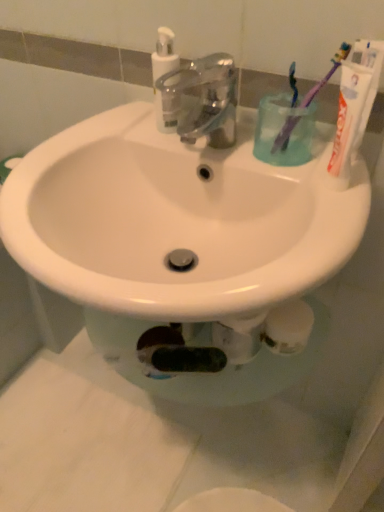
Identify the location of white glossy sink at center. The height and width of the screenshot is (512, 384). (180, 242).

Where is `metallic faucet at center`? The height and width of the screenshot is (512, 384). metallic faucet at center is located at coordinates (201, 100).

Describe the element at coordinates (326, 75) in the screenshot. This screenshot has height=512, width=384. I see `purple plastic toothbrush at upper right, acting as the 2th toothbrush starting from the left` at that location.

What do you see at coordinates (280, 130) in the screenshot?
I see `translucent plastic cup at upper right` at bounding box center [280, 130].

Where is `translucent plastic pump bottle at upper center`? translucent plastic pump bottle at upper center is located at coordinates (164, 73).

In the scene shown: Could you tell me if white matte toothpaste at upper right is turned towards purple plastic toothbrush at upper right, which is the first toothbrush from left to right?

No, white matte toothpaste at upper right is not aimed at purple plastic toothbrush at upper right, which is the first toothbrush from left to right.

Is white matte toothpaste at upper right in front of or behind purple plastic toothbrush at upper right, which is the first toothbrush from left to right, in the image?

In the image, white matte toothpaste at upper right appears in front of purple plastic toothbrush at upper right, which is the first toothbrush from left to right.

Based on their positions, is white matte toothpaste at upper right located to the left or right of purple plastic toothbrush at upper right, which is the first toothbrush from left to right?

Clearly, white matte toothpaste at upper right is on the right of purple plastic toothbrush at upper right, which is the first toothbrush from left to right, in the image.

Does point (335, 133) come behind point (295, 63)?

Yes, point (335, 133) is farther from viewer.

Does white matte toothpaste at upper right lie behind purple plastic toothbrush at upper right, acting as the 2th toothbrush starting from the left?

No, white matte toothpaste at upper right is in front of purple plastic toothbrush at upper right, acting as the 2th toothbrush starting from the left.

Is white matte toothpaste at upper right at the left side of purple plastic toothbrush at upper right, acting as the 2th toothbrush starting from the left?

Incorrect, white matte toothpaste at upper right is not on the left side of purple plastic toothbrush at upper right, acting as the 2th toothbrush starting from the left.

How different are the orientations of white matte toothpaste at upper right and purple plastic toothbrush at upper right, acting as the 2th toothbrush starting from the left, in degrees?

The angle between the facing direction of white matte toothpaste at upper right and the facing direction of purple plastic toothbrush at upper right, acting as the 2th toothbrush starting from the left, is 8.32e-06 degrees.

Is point (361, 66) positioned in front of point (331, 69)?

Yes.

Which is nearer, (159, 97) or (300, 118)?

Point (300, 118)

Considering the relative sizes of translucent plastic pump bottle at upper center and purple plastic toothbrush at upper right, acting as the 2th toothbrush starting from the left, in the image provided, is translucent plastic pump bottle at upper center wider than purple plastic toothbrush at upper right, acting as the 2th toothbrush starting from the left,?

No.

Considering the sizes of objects translucent plastic pump bottle at upper center and purple plastic toothbrush at upper right, which is the first toothbrush from right to left, in the image provided, who is shorter, translucent plastic pump bottle at upper center or purple plastic toothbrush at upper right, which is the first toothbrush from right to left,?

Standing shorter between the two is translucent plastic pump bottle at upper center.

Is translucent plastic pump bottle at upper center directly adjacent to purple plastic toothbrush at upper right, acting as the 2th toothbrush starting from the left?

translucent plastic pump bottle at upper center and purple plastic toothbrush at upper right, acting as the 2th toothbrush starting from the left, are not in contact.

Is white matte toothpaste at upper right next to white glossy sink at center and touching it?

No, white matte toothpaste at upper right is not next to white glossy sink at center.

Between white matte toothpaste at upper right and white glossy sink at center, which one has smaller width?

Thinner between the two is white matte toothpaste at upper right.

Based on the photo, who is smaller, white matte toothpaste at upper right or white glossy sink at center?

white matte toothpaste at upper right is smaller.

Is purple plastic toothbrush at upper right, which is the first toothbrush from right to left, spatially inside white matte toothpaste at upper right, or outside of it?

purple plastic toothbrush at upper right, which is the first toothbrush from right to left, is spatially situated outside white matte toothpaste at upper right.

Considering the relative positions of purple plastic toothbrush at upper right, acting as the 2th toothbrush starting from the left, and white matte toothpaste at upper right in the image provided, is purple plastic toothbrush at upper right, acting as the 2th toothbrush starting from the left, to the left of white matte toothpaste at upper right from the viewer's perspective?

Yes, purple plastic toothbrush at upper right, acting as the 2th toothbrush starting from the left, is to the left of white matte toothpaste at upper right.

Is point (328, 79) closer or farther from the camera than point (357, 93)?

Point (328, 79) is farther from the camera than point (357, 93).

Can you confirm if purple plastic toothbrush at upper right, which is the first toothbrush from left to right, is bigger than white matte toothpaste at upper right?

Actually, purple plastic toothbrush at upper right, which is the first toothbrush from left to right, might be smaller than white matte toothpaste at upper right.

Does purple plastic toothbrush at upper right, placed as the 2th toothbrush when sorted from right to left, lie in front of white matte toothpaste at upper right?

No, the depth of purple plastic toothbrush at upper right, placed as the 2th toothbrush when sorted from right to left, is greater than that of white matte toothpaste at upper right.

Considering the points (295, 95) and (343, 159), which point is in front, point (295, 95) or point (343, 159)?

The point (343, 159) is more forward.

Is purple plastic toothbrush at upper right, placed as the 2th toothbrush when sorted from right to left, looking in the opposite direction of metallic faucet at center?

No, purple plastic toothbrush at upper right, placed as the 2th toothbrush when sorted from right to left, is not facing away from metallic faucet at center.

From the image's perspective, who appears lower, purple plastic toothbrush at upper right, placed as the 2th toothbrush when sorted from right to left, or metallic faucet at center?

metallic faucet at center is shown below in the image.

Between purple plastic toothbrush at upper right, which is the first toothbrush from left to right, and metallic faucet at center, which one is positioned behind?

purple plastic toothbrush at upper right, which is the first toothbrush from left to right, is more distant.

Does purple plastic toothbrush at upper right, placed as the 2th toothbrush when sorted from right to left, have a smaller size compared to metallic faucet at center?

Indeed, purple plastic toothbrush at upper right, placed as the 2th toothbrush when sorted from right to left, has a smaller size compared to metallic faucet at center.

From the white matte toothpaste at upper right, count 2nd toothbrushs backward and point to it. Please provide its 2D coordinates.

[(293, 83)]

Find the location of a particular element. toothpaste located on the right of purple plastic toothbrush at upper right, which is the first toothbrush from right to left is located at coordinates (347, 121).

Considering their positions, is purple plastic toothbrush at upper right, placed as the 2th toothbrush when sorted from right to left, positioned further to metallic faucet at center than white matte toothpaste at upper right?

Among the two, white matte toothpaste at upper right is located further to metallic faucet at center.

Considering their positions, is purple plastic toothbrush at upper right, which is the first toothbrush from right to left, positioned closer to purple plastic toothbrush at upper right, placed as the 2th toothbrush when sorted from right to left, than translucent plastic pump bottle at upper center?

purple plastic toothbrush at upper right, which is the first toothbrush from right to left, lies closer to purple plastic toothbrush at upper right, placed as the 2th toothbrush when sorted from right to left, than the other object.

Estimate the real-world distances between objects in this image. Which object is further from metallic faucet at center, white glossy sink at center or translucent plastic pump bottle at upper center?

white glossy sink at center lies further to metallic faucet at center than the other object.

Considering their positions, is purple plastic toothbrush at upper right, which is the first toothbrush from right to left, positioned closer to translucent plastic cup at upper right than white glossy sink at center?

purple plastic toothbrush at upper right, which is the first toothbrush from right to left, is closer to translucent plastic cup at upper right.

From the image, which object appears to be nearer to white glossy sink at center, white matte toothpaste at upper right or metallic faucet at center?

Based on the image, metallic faucet at center appears to be nearer to white glossy sink at center.

Estimate the real-world distances between objects in this image. Which object is further from white glossy sink at center, metallic faucet at center or purple plastic toothbrush at upper right, which is the first toothbrush from right to left?

Among the two, purple plastic toothbrush at upper right, which is the first toothbrush from right to left, is located further to white glossy sink at center.

Considering their positions, is purple plastic toothbrush at upper right, placed as the 2th toothbrush when sorted from right to left, positioned further to translucent plastic pump bottle at upper center than white matte toothpaste at upper right?

white matte toothpaste at upper right is positioned further to the anchor translucent plastic pump bottle at upper center.

Based on their spatial positions, is white matte toothpaste at upper right or translucent plastic pump bottle at upper center further from purple plastic toothbrush at upper right, which is the first toothbrush from left to right?

translucent plastic pump bottle at upper center lies further to purple plastic toothbrush at upper right, which is the first toothbrush from left to right, than the other object.

The width and height of the screenshot is (384, 512). I want to click on tap between translucent plastic pump bottle at upper center and purple plastic toothbrush at upper right, acting as the 2th toothbrush starting from the left, from left to right, so click(x=201, y=100).

Locate an element on the screen. The height and width of the screenshot is (512, 384). liquid situated between translucent plastic pump bottle at upper center and purple plastic toothbrush at upper right, placed as the 2th toothbrush when sorted from right to left, from left to right is located at coordinates (280, 130).

Image resolution: width=384 pixels, height=512 pixels. What are the coordinates of `tap located between translucent plastic pump bottle at upper center and purple plastic toothbrush at upper right, which is the first toothbrush from left to right, in the left-right direction` in the screenshot? It's located at (201, 100).

Locate an element on the screen. toothbrush positioned between purple plastic toothbrush at upper right, which is the first toothbrush from right to left, and translucent plastic cup at upper right from near to far is located at coordinates (293, 83).